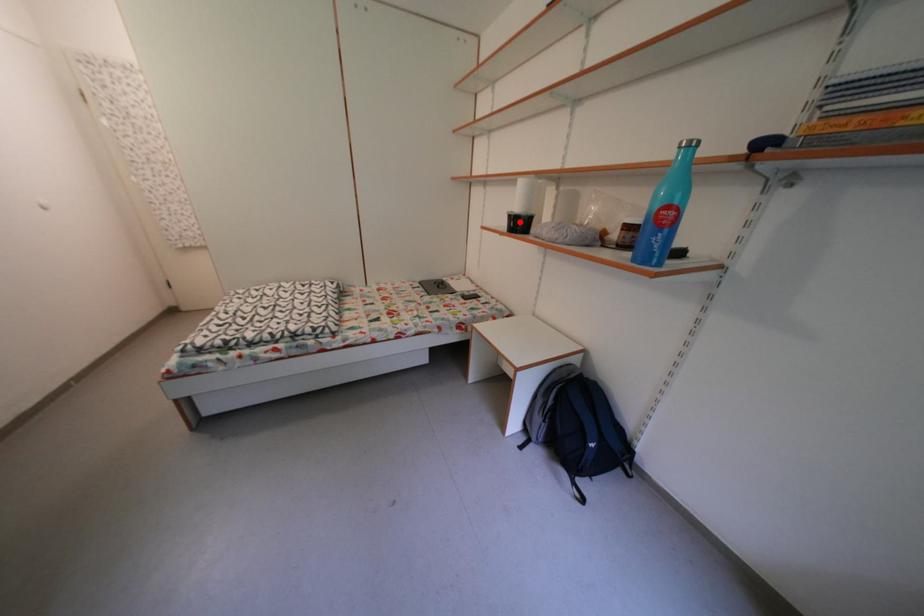
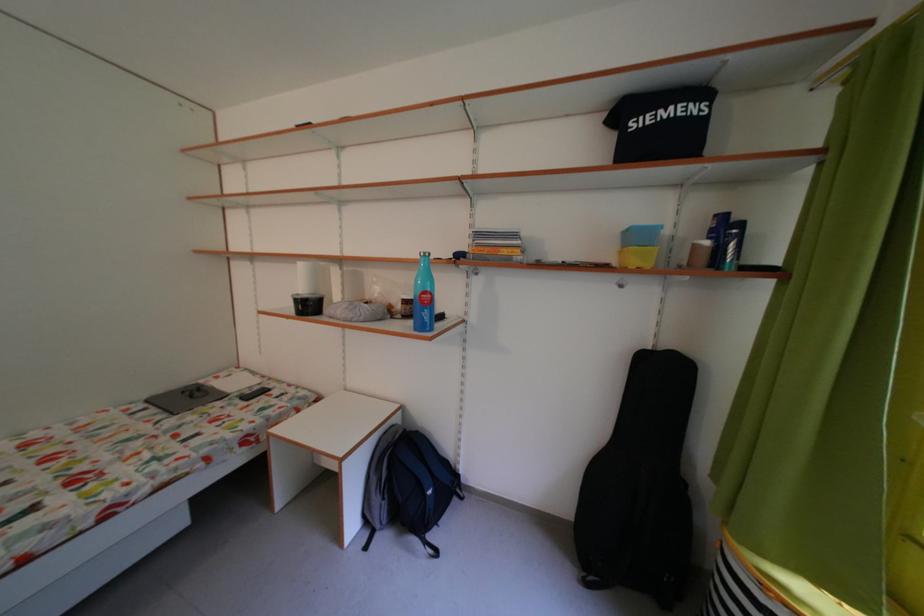
Locate, in the second image, the point that corresponds to the highlighted location in the first image.

(306, 306)